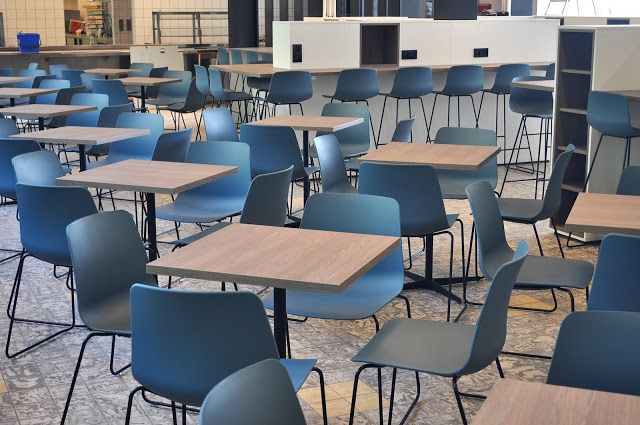
You are a GUI agent. You are given a task and a screenshot of the screen. Output one action in this format:
    pyautogui.click(x=<x>, y=<y>)
    Task: Click on the shelves
    
    Given the screenshot: What is the action you would take?
    pyautogui.click(x=573, y=71), pyautogui.click(x=572, y=113), pyautogui.click(x=572, y=153), pyautogui.click(x=564, y=188), pyautogui.click(x=604, y=71)